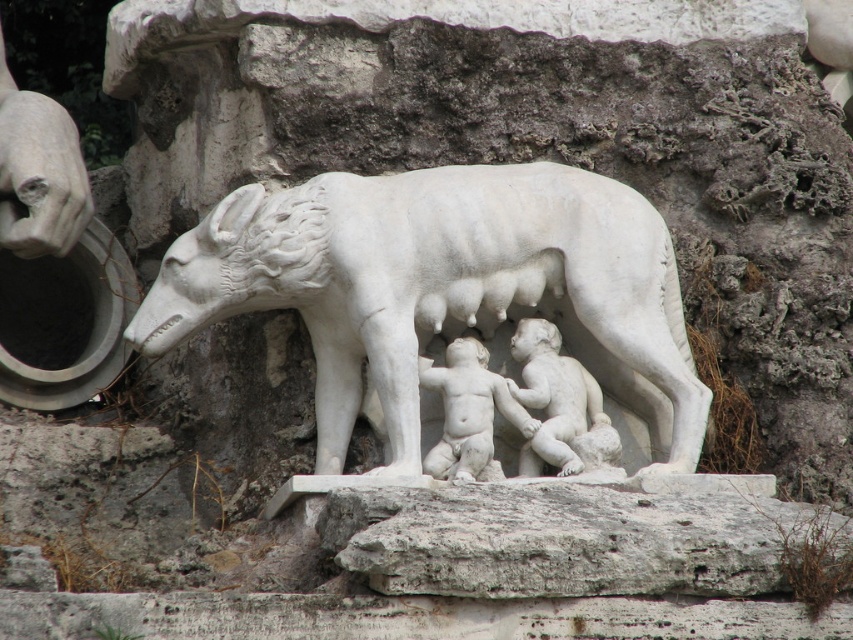
You are an art conservator examining the classical sculpture of the wolf nursing infants. You need to determine which object is taller between the white marble wolf at center and the smooth white cherub at center. Based on the sculpture, which one is taller?

The white marble wolf at center is much taller than the smooth white cherub at center.